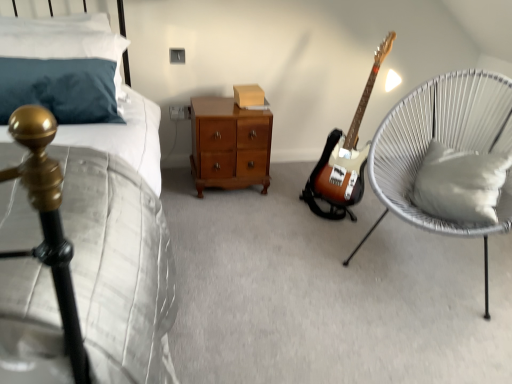
This screenshot has width=512, height=384. In order to click on vacant space in front of white woven chair at right in this screenshot , I will do `click(411, 332)`.